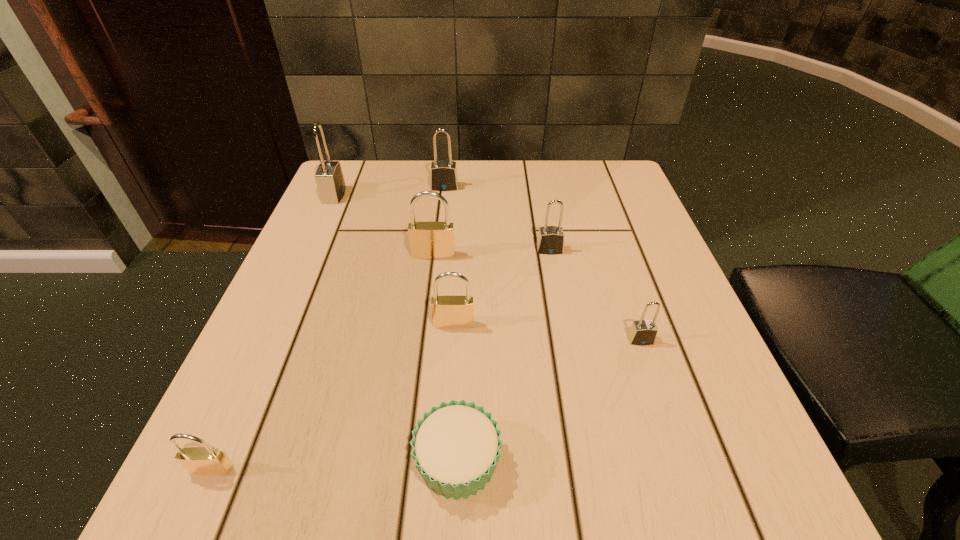
Locate an element on the screen. free space between the farthest brass padlock and the third smallest gray padlock is located at coordinates (439, 221).

This screenshot has width=960, height=540. Find the location of `vacant area between the nearest brass padlock and the tallest padlock`. vacant area between the nearest brass padlock and the tallest padlock is located at coordinates (273, 332).

Locate an element on the screen. This screenshot has height=540, width=960. the fourth closest object to the second smallest gray padlock is located at coordinates (444, 177).

Locate an element on the screen. the second closest object to the rightmost padlock is located at coordinates (456, 447).

Find the location of a particular element. The height and width of the screenshot is (540, 960). padlock identified as the fourth closest to the nearest brass padlock is located at coordinates (329, 177).

The width and height of the screenshot is (960, 540). What are the coordinates of `padlock that is the second closest to the shortest object` in the screenshot? It's located at (205, 460).

This screenshot has height=540, width=960. Find the location of `gray padlock that is the second closest to the smallest brass padlock`. gray padlock that is the second closest to the smallest brass padlock is located at coordinates [329, 177].

I want to click on gray padlock that is the third closest to the biggest brass padlock, so click(329, 177).

Choose which brass padlock is the nearest neighbor to the third smallest gray padlock. Please provide its 2D coordinates. Your answer should be formatted as a tuple, i.e. [(x, y)], where the tuple contains the x and y coordinates of a point satisfying the conditions above.

[(428, 240)]

Find the location of `brass padlock that is the second closest to the second nearest brass padlock`. brass padlock that is the second closest to the second nearest brass padlock is located at coordinates (205, 460).